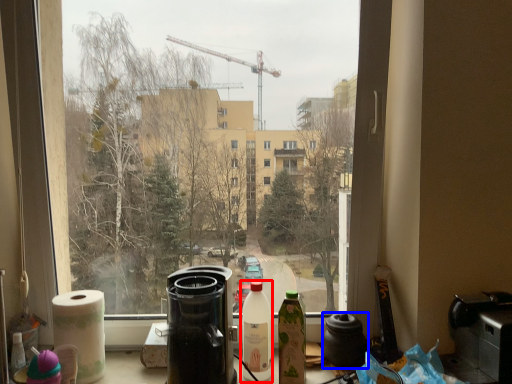
Question: Among these objects, which one is farthest to the camera, bottle (highlighted by a red box) or coffeepot (highlighted by a blue box)?

Choices:
 (A) bottle
 (B) coffeepot

Answer: (B)